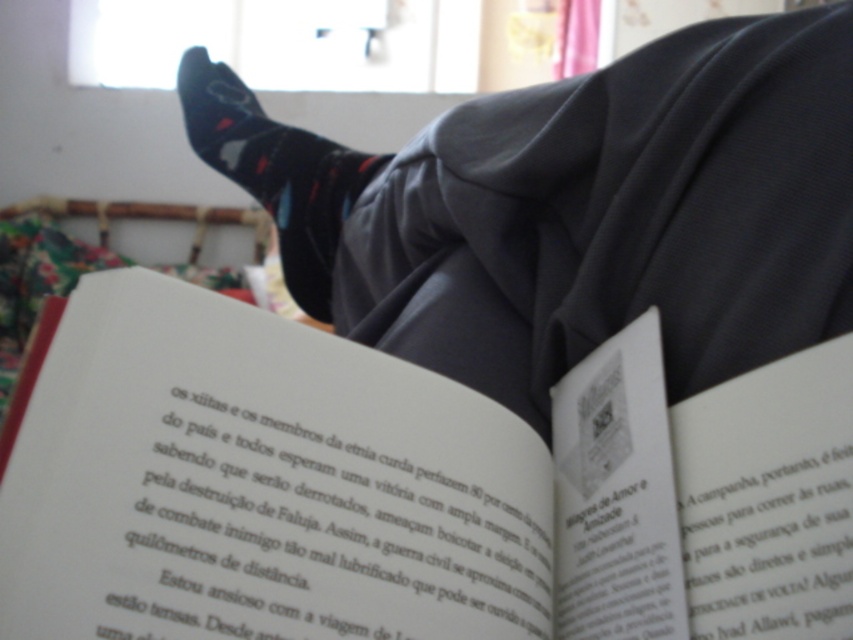
Consider the image. Who is more forward, (177,552) or (577,198)?

Point (177,552) is more forward.

From the picture: Is white paper at upper center to the right of multicolored socks at upper center from the viewer's perspective?

Correct, you'll find white paper at upper center to the right of multicolored socks at upper center.

Does point (39, 426) come farther from viewer compared to point (825, 296)?

No, (39, 426) is closer to viewer.

You are a GUI agent. You are given a task and a screenshot of the screen. Output one action in this format:
    pyautogui.click(x=<x>, y=<y>)
    Task: Click on the white paper at upper center
    This screenshot has height=640, width=853.
    Given the screenshot: What is the action you would take?
    pyautogui.click(x=409, y=488)

Is white paper at upper center above black matte socks at upper center?

Actually, white paper at upper center is below black matte socks at upper center.

Is white paper at upper center further to camera compared to black matte socks at upper center?

No, it is not.

At what (x,y) coordinates should I click in order to perform the action: click on white paper at upper center. Please return your answer as a coordinate pair (x, y). Looking at the image, I should click on (409, 488).

Is multicolored socks at upper center to the left of black matte socks at upper center from the viewer's perspective?

In fact, multicolored socks at upper center is to the right of black matte socks at upper center.

This screenshot has width=853, height=640. Describe the element at coordinates (576, 209) in the screenshot. I see `multicolored socks at upper center` at that location.

The image size is (853, 640). Find the location of `multicolored socks at upper center`. multicolored socks at upper center is located at coordinates (576, 209).